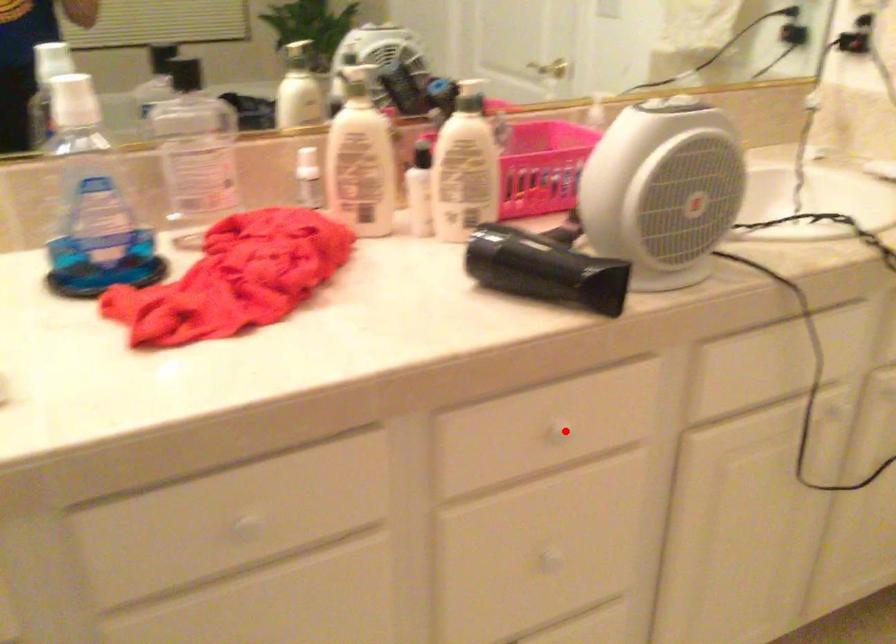
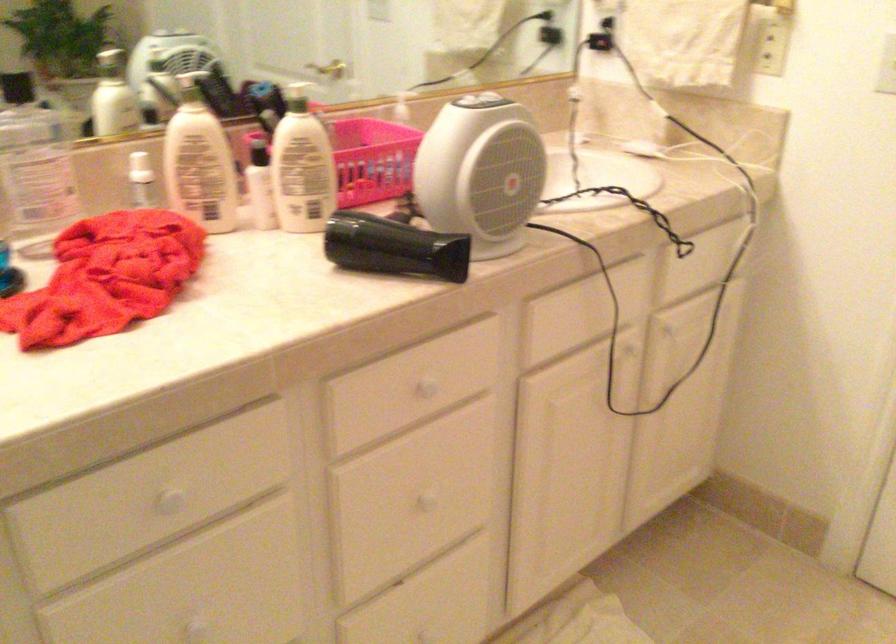
Find the pixel in the second image that matches the highlighted location in the first image.

(426, 386)